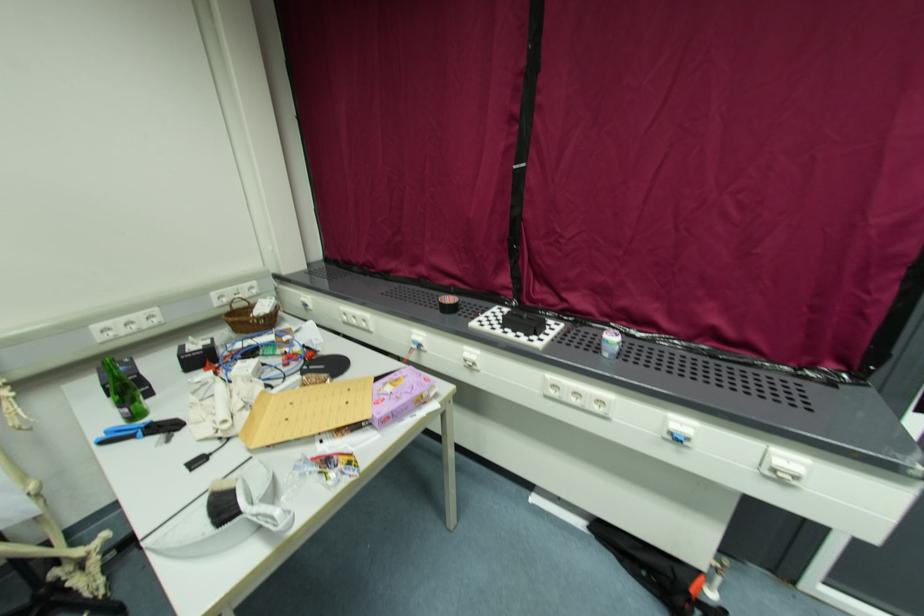
Find where to lift the white cleaning tool handle. Please return your answer as a coordinate pair (x, y).

(271, 517)